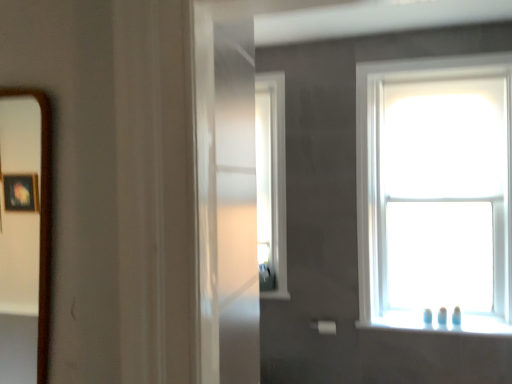
Describe the element at coordinates (435, 194) in the screenshot. This screenshot has width=512, height=384. I see `transparent glass window at upper right, the second window in the left-to-right sequence` at that location.

What do you see at coordinates (19, 253) in the screenshot? I see `brown wooden mirror at left` at bounding box center [19, 253].

What do you see at coordinates (438, 323) in the screenshot? I see `white glossy window sill at lower right` at bounding box center [438, 323].

Identify the location of clear glass window at center, arranged as the 2th window when viewed from the right. This screenshot has width=512, height=384. (271, 183).

What do you see at coordinates (271, 183) in the screenshot? The height and width of the screenshot is (384, 512). I see `clear glass window at center, arranged as the 2th window when viewed from the right` at bounding box center [271, 183].

Locate an element on the screen. This screenshot has width=512, height=384. transparent glass window at upper right, positioned as the 1th window in right-to-left order is located at coordinates (435, 194).

Between white matte towel bar at lower right and white glossy window sill at lower right, which one has larger width?

white glossy window sill at lower right is wider.

Is white matte towel bar at lower right turned away from white glossy window sill at lower right?

That's not correct — white matte towel bar at lower right is not looking away from white glossy window sill at lower right.

From a real-world perspective, is white matte towel bar at lower right physically located above or below white glossy window sill at lower right?

From a real-world perspective, white matte towel bar at lower right is physically below white glossy window sill at lower right.

Which of these two, white matte towel bar at lower right or white glossy window sill at lower right, is smaller?

white matte towel bar at lower right.

Is clear glass window at center, which ranks as the first window in left-to-right order, at the left side of white glossy window sill at lower right?

Correct, you'll find clear glass window at center, which ranks as the first window in left-to-right order, to the left of white glossy window sill at lower right.

Measure the distance from clear glass window at center, which ranks as the first window in left-to-right order, to white glossy window sill at lower right.

clear glass window at center, which ranks as the first window in left-to-right order, is 3.40 feet from white glossy window sill at lower right.

Is clear glass window at center, arranged as the 2th window when viewed from the right, inside or outside of white glossy window sill at lower right?

The correct answer is: outside.

Is point (262, 284) positioned before point (357, 325)?

No, (262, 284) is behind (357, 325).

Is brown wooden mirror at left in front of or behind white matte towel bar at lower right in the image?

Clearly, brown wooden mirror at left is in front of white matte towel bar at lower right.

Is brown wooden mirror at left taller than white matte towel bar at lower right?

Yes, brown wooden mirror at left is taller than white matte towel bar at lower right.

Is brown wooden mirror at left turned away from white matte towel bar at lower right?

No.

Considering the sizes of objects brown wooden mirror at left and white matte towel bar at lower right in the image provided, who is wider, brown wooden mirror at left or white matte towel bar at lower right?

white matte towel bar at lower right is wider.

Would you say white glossy window sill at lower right is inside or outside transparent glass window at upper right, positioned as the 1th window in right-to-left order?

white glossy window sill at lower right is not enclosed by transparent glass window at upper right, positioned as the 1th window in right-to-left order.

Considering the sizes of objects white glossy window sill at lower right and transparent glass window at upper right, positioned as the 1th window in right-to-left order, in the image provided, who is thinner, white glossy window sill at lower right or transparent glass window at upper right, positioned as the 1th window in right-to-left order,?

white glossy window sill at lower right is thinner.

Is white glossy window sill at lower right oriented away from transparent glass window at upper right, positioned as the 1th window in right-to-left order?

No, white glossy window sill at lower right is not facing the opposite direction of transparent glass window at upper right, positioned as the 1th window in right-to-left order.

Between transparent glass window at upper right, the second window in the left-to-right sequence, and brown wooden mirror at left, which one has smaller width?

brown wooden mirror at left is thinner.

Considering the positions of points (431, 260) and (22, 98), is point (431, 260) closer to camera compared to point (22, 98)?

No, it is not.

Considering the relative positions of transparent glass window at upper right, the second window in the left-to-right sequence, and brown wooden mirror at left in the image provided, is transparent glass window at upper right, the second window in the left-to-right sequence, to the right of brown wooden mirror at left from the viewer's perspective?

Indeed, transparent glass window at upper right, the second window in the left-to-right sequence, is positioned on the right side of brown wooden mirror at left.

From the image's perspective, which object appears higher, transparent glass window at upper right, positioned as the 1th window in right-to-left order, or brown wooden mirror at left?

transparent glass window at upper right, positioned as the 1th window in right-to-left order.

Relative to clear glass window at center, which ranks as the first window in left-to-right order, is white matte towel bar at lower right in front or behind?

Clearly, white matte towel bar at lower right is in front of clear glass window at center, which ranks as the first window in left-to-right order.

Are white matte towel bar at lower right and clear glass window at center, which ranks as the first window in left-to-right order, far apart?

No, there isn't a large distance between white matte towel bar at lower right and clear glass window at center, which ranks as the first window in left-to-right order.

Which is behind, point (332, 332) or point (260, 131)?

Positioned behind is point (260, 131).

Can you confirm if white matte towel bar at lower right is wider than clear glass window at center, which ranks as the first window in left-to-right order?

No.

Is transparent glass window at upper right, positioned as the 1th window in right-to-left order, not close to white matte towel bar at lower right?

That's right, there is a large distance between transparent glass window at upper right, positioned as the 1th window in right-to-left order, and white matte towel bar at lower right.

Consider the image. Is white matte towel bar at lower right inside transparent glass window at upper right, positioned as the 1th window in right-to-left order?

No.

Does transparent glass window at upper right, positioned as the 1th window in right-to-left order, have a greater height compared to white matte towel bar at lower right?

Yes, transparent glass window at upper right, positioned as the 1th window in right-to-left order, is taller than white matte towel bar at lower right.

Looking at this image, between transparent glass window at upper right, positioned as the 1th window in right-to-left order, and white matte towel bar at lower right, which one has larger width?

transparent glass window at upper right, positioned as the 1th window in right-to-left order.

This screenshot has height=384, width=512. I want to click on window sill lying in front of the white matte towel bar at lower right, so (438, 323).

Find the location of a particular element. The image size is (512, 384). the 2nd window above the white glossy window sill at lower right (from the image's perspective) is located at coordinates (271, 183).

Based on their spatial positions, is brown wooden mirror at left or white glossy window sill at lower right closer to transparent glass window at upper right, positioned as the 1th window in right-to-left order?

white glossy window sill at lower right is positioned closer to the anchor transparent glass window at upper right, positioned as the 1th window in right-to-left order.

Estimate the real-world distances between objects in this image. Which object is closer to white glossy window sill at lower right, white matte towel bar at lower right or clear glass window at center, arranged as the 2th window when viewed from the right?

white matte towel bar at lower right is positioned closer to the anchor white glossy window sill at lower right.

Looking at this image, estimate the real-world distances between objects in this image. Which object is closer to white matte towel bar at lower right, clear glass window at center, which ranks as the first window in left-to-right order, or brown wooden mirror at left?

clear glass window at center, which ranks as the first window in left-to-right order.

Looking at the image, which one is located closer to white glossy window sill at lower right, clear glass window at center, arranged as the 2th window when viewed from the right, or brown wooden mirror at left?

Among the two, clear glass window at center, arranged as the 2th window when viewed from the right, is located nearer to white glossy window sill at lower right.

Based on their spatial positions, is white matte towel bar at lower right or white glossy window sill at lower right closer to transparent glass window at upper right, positioned as the 1th window in right-to-left order?

white glossy window sill at lower right is closer to transparent glass window at upper right, positioned as the 1th window in right-to-left order.

Consider the image. Which object lies further to the anchor point transparent glass window at upper right, positioned as the 1th window in right-to-left order, white glossy window sill at lower right or brown wooden mirror at left?

brown wooden mirror at left.

Which object lies nearer to the anchor point brown wooden mirror at left, transparent glass window at upper right, positioned as the 1th window in right-to-left order, or white matte towel bar at lower right?

Based on the image, white matte towel bar at lower right appears to be nearer to brown wooden mirror at left.

Which object lies nearer to the anchor point white matte towel bar at lower right, brown wooden mirror at left or white glossy window sill at lower right?

white glossy window sill at lower right is positioned closer to the anchor white matte towel bar at lower right.

At what (x,y) coordinates should I click in order to perform the action: click on window sill between transparent glass window at upper right, positioned as the 1th window in right-to-left order, and white matte towel bar at lower right vertically. Please return your answer as a coordinate pair (x, y). The width and height of the screenshot is (512, 384). Looking at the image, I should click on (438, 323).

Identify the location of window sill between brown wooden mirror at left and transparent glass window at upper right, the second window in the left-to-right sequence. The image size is (512, 384). (438, 323).

Find the location of a particular element. window between brown wooden mirror at left and white glossy window sill at lower right from left to right is located at coordinates [271, 183].

You are a GUI agent. You are given a task and a screenshot of the screen. Output one action in this format:
    pyautogui.click(x=<x>, y=<y>)
    Task: Click on the window sill between clear glass window at center, arranged as the 2th window when viewed from the right, and transparent glass window at upper right, positioned as the 1th window in right-to-left order, in the horizontal direction
    The width and height of the screenshot is (512, 384).
    Given the screenshot: What is the action you would take?
    pyautogui.click(x=438, y=323)